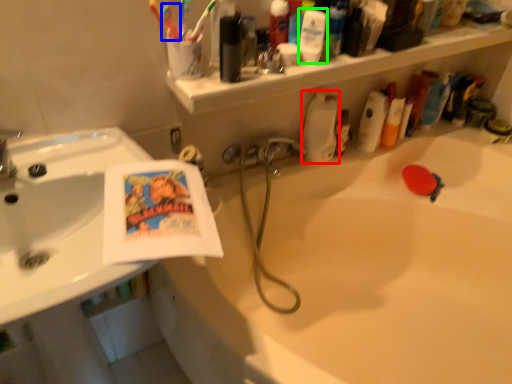
Question: Which is farther away from cleaning product (highlighted by a red box)? toothbrush (highlighted by a blue box) or mouthwash (highlighted by a green box)?

Choices:
 (A) toothbrush
 (B) mouthwash

Answer: (A)